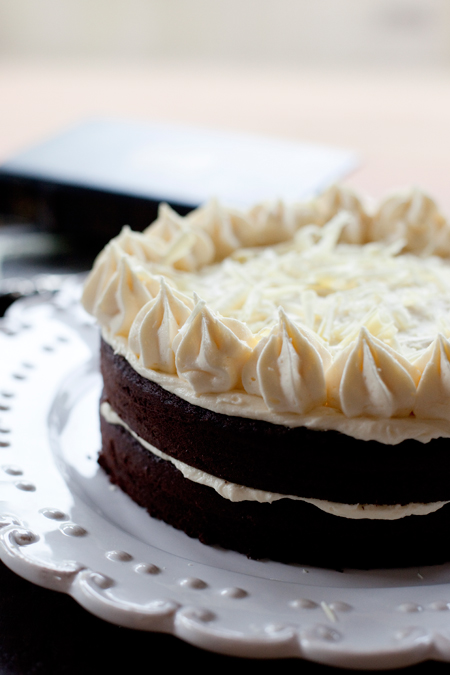
This screenshot has height=675, width=450. Find the location of `white wall background`. white wall background is located at coordinates (165, 57).